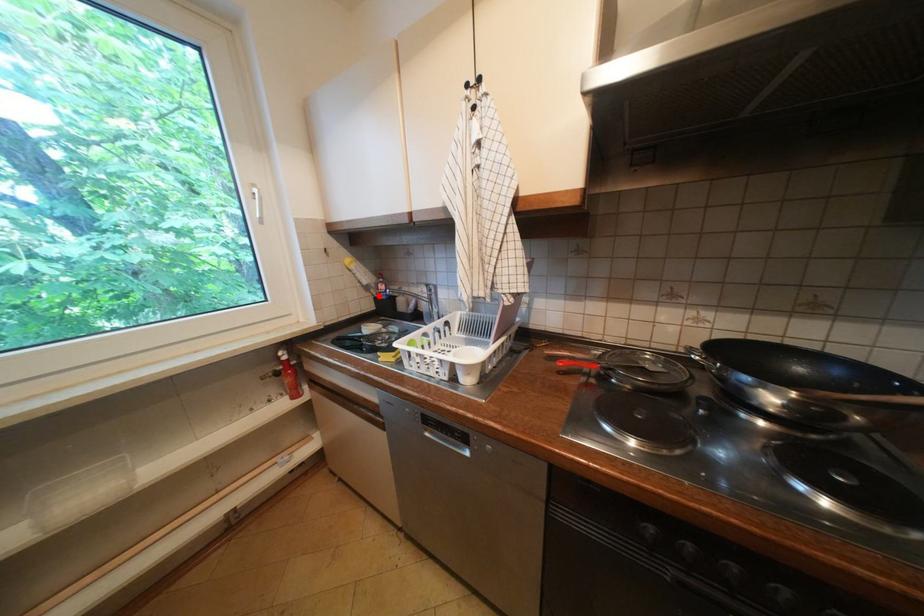
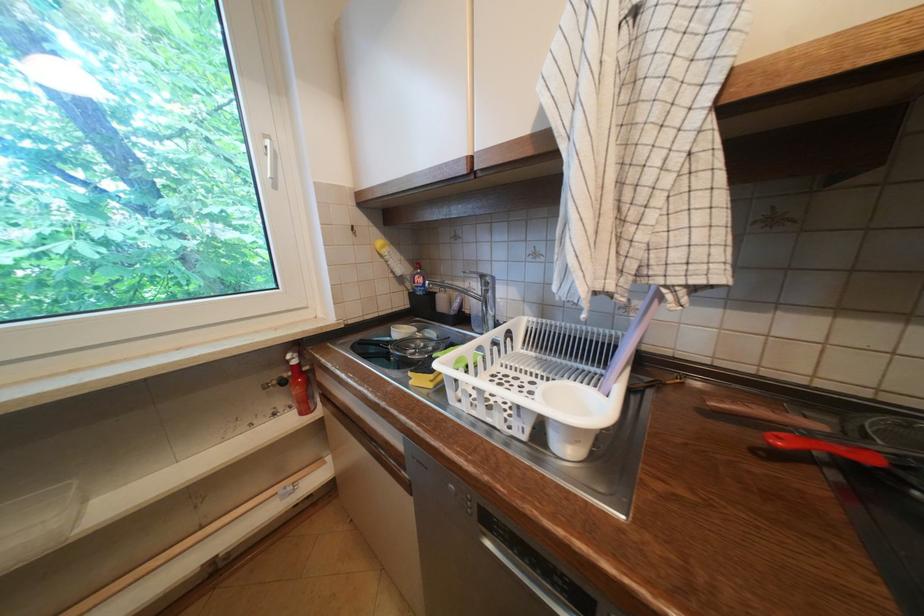
Where in the second image is the point corresponding to the highlighted location from the first image?

(412, 291)